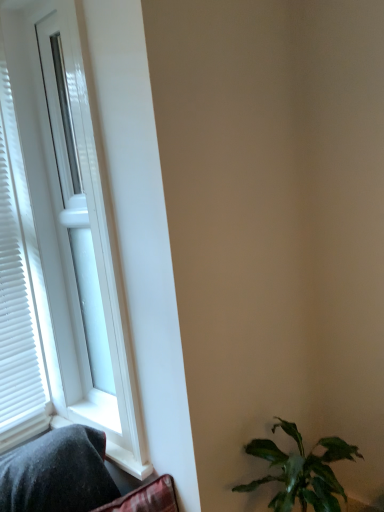
Question: Are green leafy plant at lower right and white glossy window at left located far from each other?

Choices:
 (A) no
 (B) yes

Answer: (A)

Question: From the image's perspective, is green leafy plant at lower right on top of white glossy window at left?

Choices:
 (A) yes
 (B) no

Answer: (B)

Question: Is green leafy plant at lower right outside of white glossy window at left?

Choices:
 (A) no
 (B) yes

Answer: (B)

Question: Does green leafy plant at lower right come behind white glossy window at left?

Choices:
 (A) yes
 (B) no

Answer: (B)

Question: Is green leafy plant at lower right at the right side of white glossy window at left?

Choices:
 (A) yes
 (B) no

Answer: (A)

Question: Is green leafy plant at lower right smaller than white glossy window at left?

Choices:
 (A) no
 (B) yes

Answer: (B)

Question: From the image's perspective, is white glossy window at left over green leafy plant at lower right?

Choices:
 (A) no
 (B) yes

Answer: (B)

Question: Can you confirm if white glossy window at left is positioned to the right of green leafy plant at lower right?

Choices:
 (A) no
 (B) yes

Answer: (A)

Question: Considering the relative sizes of white glossy window at left and green leafy plant at lower right in the image provided, is white glossy window at left taller than green leafy plant at lower right?

Choices:
 (A) no
 (B) yes

Answer: (B)

Question: Does white glossy window at left have a greater width compared to green leafy plant at lower right?

Choices:
 (A) yes
 (B) no

Answer: (B)

Question: Can you confirm if white glossy window at left is shorter than green leafy plant at lower right?

Choices:
 (A) yes
 (B) no

Answer: (B)

Question: Is white glossy window at left at the left side of green leafy plant at lower right?

Choices:
 (A) yes
 (B) no

Answer: (A)

Question: Considering the positions of point (31, 173) and point (276, 496), is point (31, 173) closer or farther from the camera than point (276, 496)?

Choices:
 (A) closer
 (B) farther

Answer: (B)